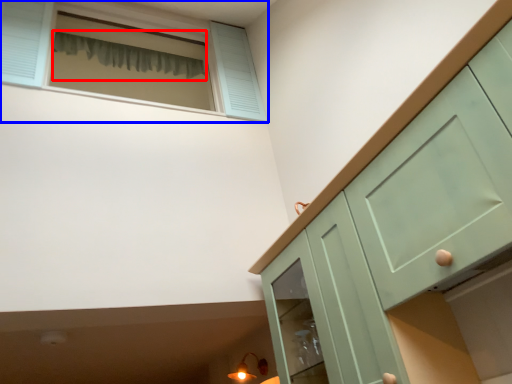
Question: Among these objects, which one is farthest to the camera, curtain (highlighted by a red box) or window (highlighted by a blue box)?

Choices:
 (A) curtain
 (B) window

Answer: (A)